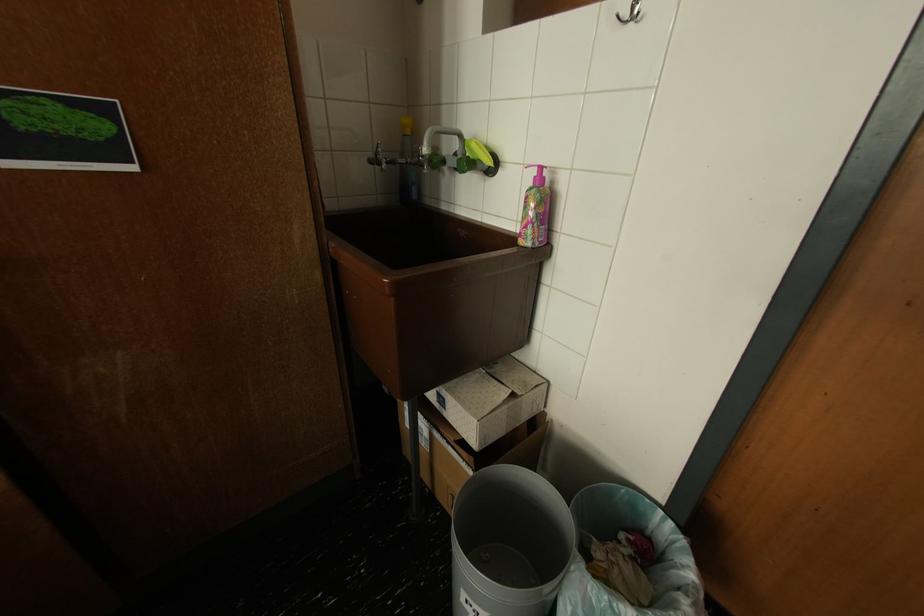
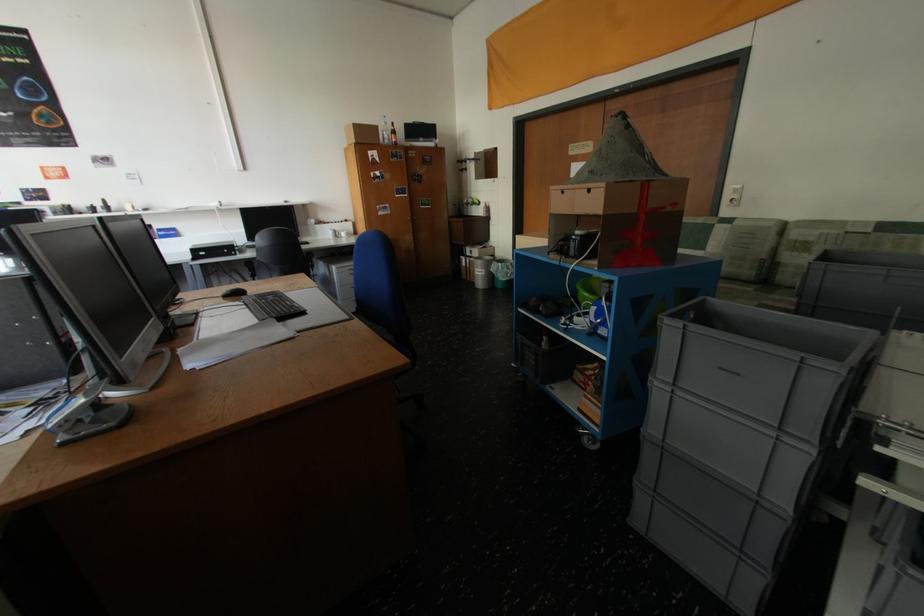
Find the pixel in the second image that matches point 142,169 in the first image.

(439, 208)